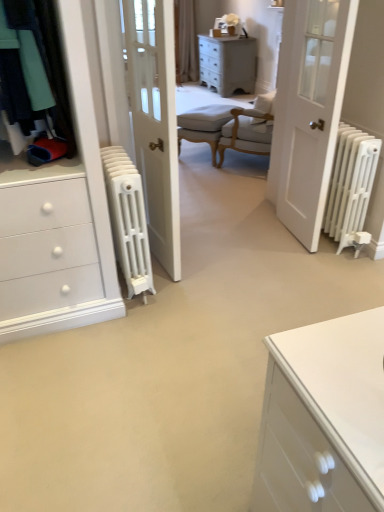
Question: Is beige fabric curtain at upper center facing towards white matte radiator at right, the 1th radiator viewed from the right?

Choices:
 (A) no
 (B) yes

Answer: (B)

Question: Is beige fabric curtain at upper center positioned before white matte radiator at right, marked as the second radiator in a left-to-right arrangement?

Choices:
 (A) yes
 (B) no

Answer: (B)

Question: Is beige fabric curtain at upper center not close to white matte radiator at right, marked as the second radiator in a left-to-right arrangement?

Choices:
 (A) yes
 (B) no

Answer: (A)

Question: From the image's perspective, is beige fabric curtain at upper center located above white matte radiator at right, marked as the second radiator in a left-to-right arrangement?

Choices:
 (A) yes
 (B) no

Answer: (A)

Question: Is beige fabric curtain at upper center looking in the opposite direction of white matte radiator at right, marked as the second radiator in a left-to-right arrangement?

Choices:
 (A) no
 (B) yes

Answer: (A)

Question: Considering the positions of beige fabric curtain at upper center and distressed white chest of drawers at upper center in the image, is beige fabric curtain at upper center wider or thinner than distressed white chest of drawers at upper center?

Choices:
 (A) thin
 (B) wide

Answer: (A)

Question: Would you say beige fabric curtain at upper center is inside or outside distressed white chest of drawers at upper center?

Choices:
 (A) outside
 (B) inside

Answer: (A)

Question: From the image's perspective, relative to distressed white chest of drawers at upper center, is beige fabric curtain at upper center above or below?

Choices:
 (A) above
 (B) below

Answer: (A)

Question: Considering the positions of beige fabric curtain at upper center and distressed white chest of drawers at upper center in the image, is beige fabric curtain at upper center taller or shorter than distressed white chest of drawers at upper center?

Choices:
 (A) short
 (B) tall

Answer: (B)

Question: Is distressed white chest of drawers at upper center to the left or to the right of beige fabric curtain at upper center in the image?

Choices:
 (A) left
 (B) right

Answer: (B)

Question: Considering the positions of distressed white chest of drawers at upper center and beige fabric curtain at upper center in the image, is distressed white chest of drawers at upper center wider or thinner than beige fabric curtain at upper center?

Choices:
 (A) wide
 (B) thin

Answer: (A)

Question: In the image, is distressed white chest of drawers at upper center positioned in front of or behind beige fabric curtain at upper center?

Choices:
 (A) behind
 (B) front

Answer: (B)

Question: Is distressed white chest of drawers at upper center inside or outside of beige fabric curtain at upper center?

Choices:
 (A) inside
 (B) outside

Answer: (B)

Question: Considering the positions of white matte radiator at right and white matte radiator at right, the 1th radiator viewed from the right, in the image, is white matte radiator at right bigger or smaller than white matte radiator at right, the 1th radiator viewed from the right,?

Choices:
 (A) big
 (B) small

Answer: (A)

Question: Considering their positions, is white matte radiator at right located in front of or behind white matte radiator at right, the 1th radiator viewed from the right?

Choices:
 (A) behind
 (B) front

Answer: (B)